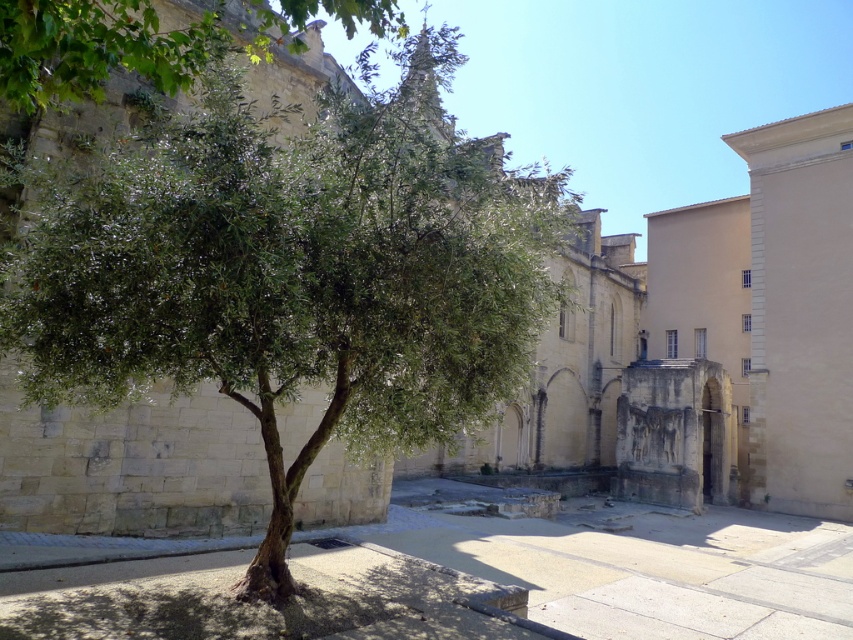
You are standing at the center of the courtyard. Which direction should you walk to reach the green leafy tree at left?

Since the green leafy tree at left is located at point 0.428 on the x axis and 0.345 on the y axis, you should walk towards the left side of the courtyard to reach it.

You are standing in the courtyard and want to take a photo of the green leafy tree at upper left without the smooth stone pavement at center blocking the view. Is this possible?

The green leafy tree at upper left is behind the smooth stone pavement at center, so you cannot take a photo of the green leafy tree at upper left without the smooth stone pavement at center blocking the view.